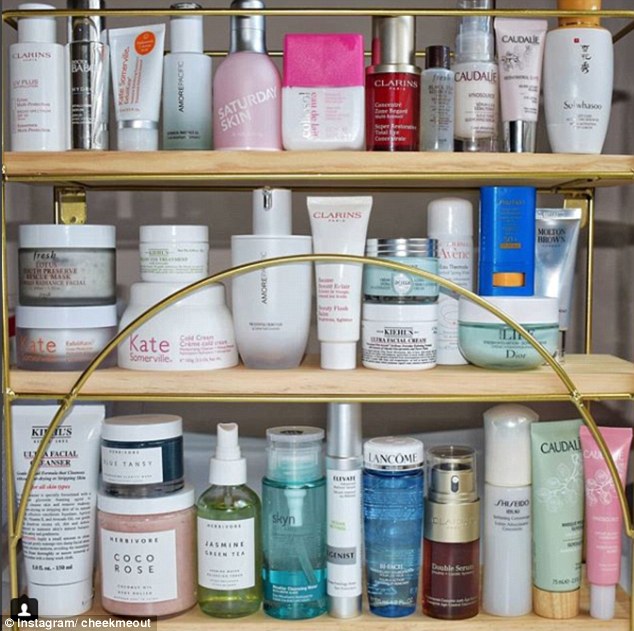
Where is `product - clariss - red bottle with silver top, on the top shelf`? product - clariss - red bottle with silver top, on the top shelf is located at coordinates (389, 93), (395, 23).